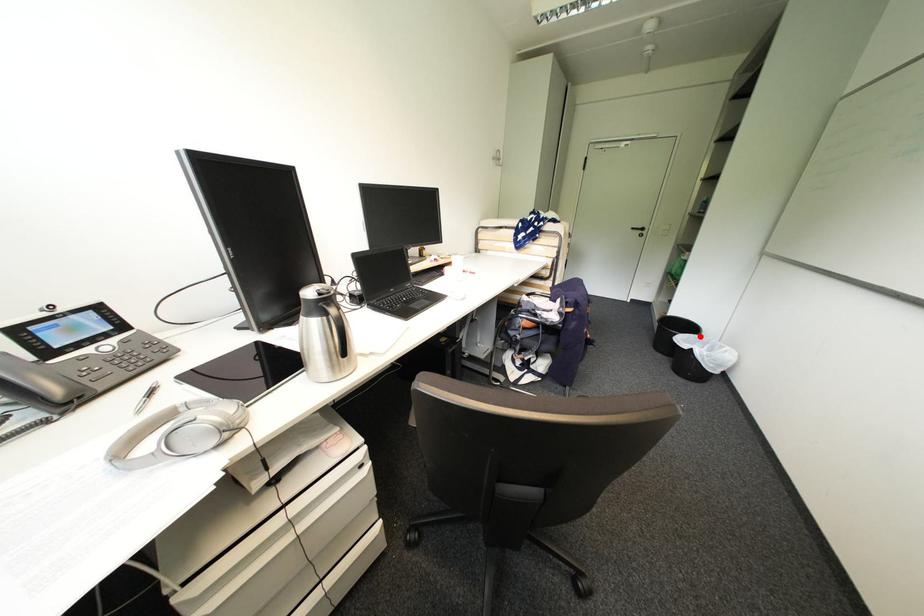
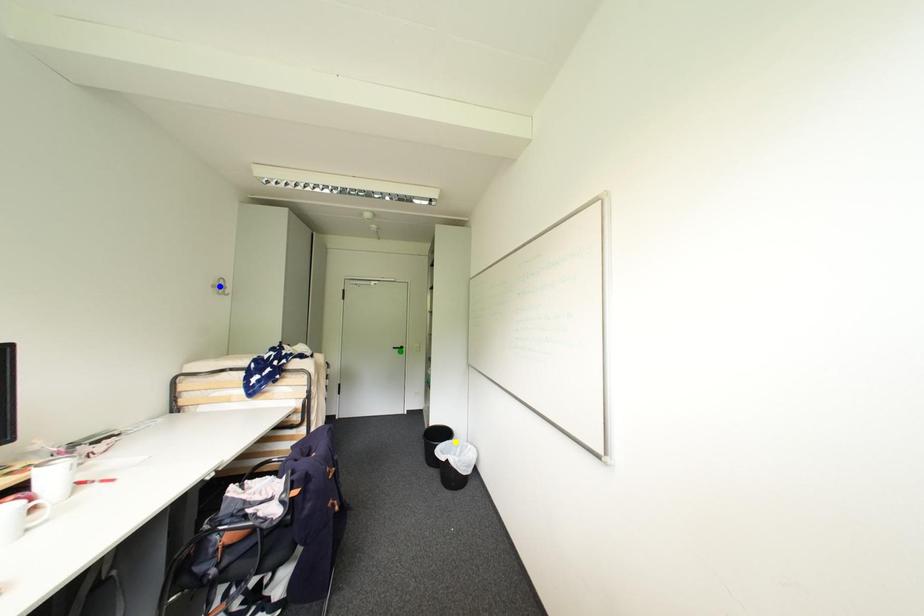
Question: I am providing you with two images of the same scene from different viewpoints. A red point is marked on the first image. You are given multiple points on the second image. Can you choose the point in image 2 that corresponds to the point in image 1?

Choices:
 (A) green point
 (B) yellow point
 (C) blue point

Answer: (B)